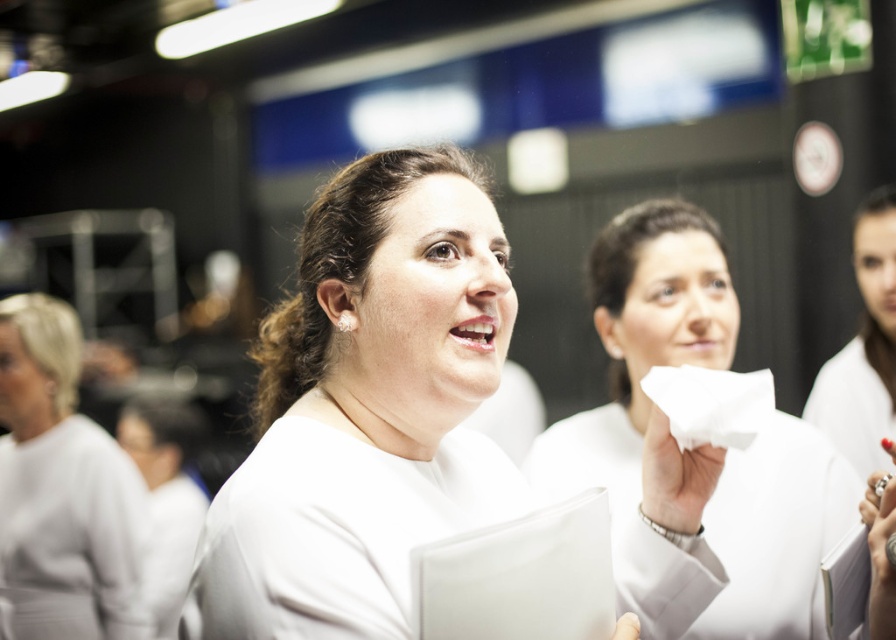
Question: Which object is farther from the camera taking this photo?

Choices:
 (A) white matte sweater at center
 (B) white matte paper towel at center
 (C) white matte robe at center
 (D) white matte uniform at center

Answer: (C)

Question: Does white matte uniform at center have a larger size compared to white matte sweater at center?

Choices:
 (A) no
 (B) yes

Answer: (A)

Question: Does white matte paper towel at center appear under white matte uniform at upper right?

Choices:
 (A) yes
 (B) no

Answer: (A)

Question: Which point is farther to the camera?

Choices:
 (A) white matte sweater at center
 (B) white matte uniform at center
 (C) white matte uniform at upper right

Answer: (A)

Question: Which of the following is the closest to the observer?

Choices:
 (A) (283, 362)
 (B) (161, 540)
 (C) (578, 468)

Answer: (A)

Question: Does white matte uniform at center lie in front of white matte robe at center?

Choices:
 (A) no
 (B) yes

Answer: (B)